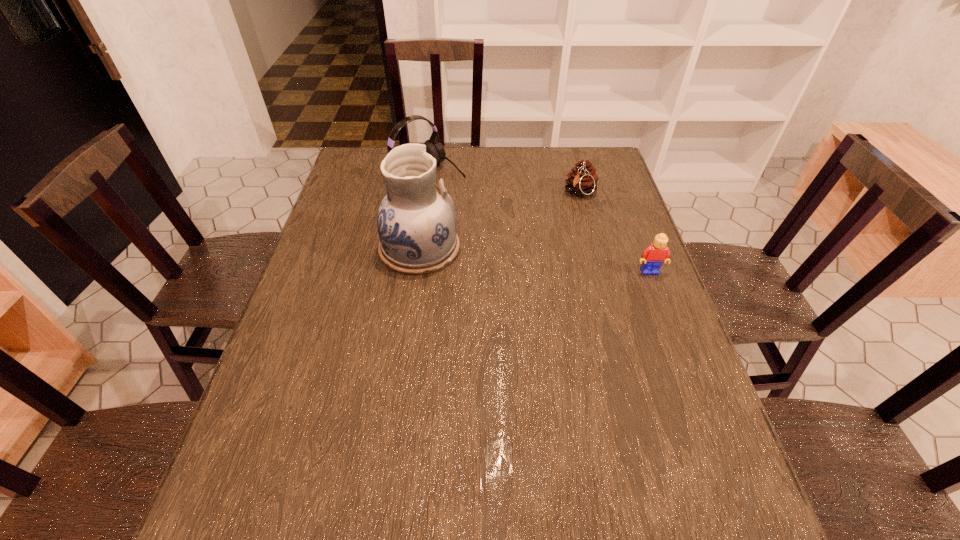
Identify the location of free space on the desktop that is between the tallest object and the rightmost object and is positioned with a leaf charm attached to the pinecone. The height and width of the screenshot is (540, 960). (540, 260).

The height and width of the screenshot is (540, 960). What are the coordinates of `vacant space on the desktop that is between the pottery and the Lego and is positioned on the ear cushions of the headset` in the screenshot? It's located at (542, 261).